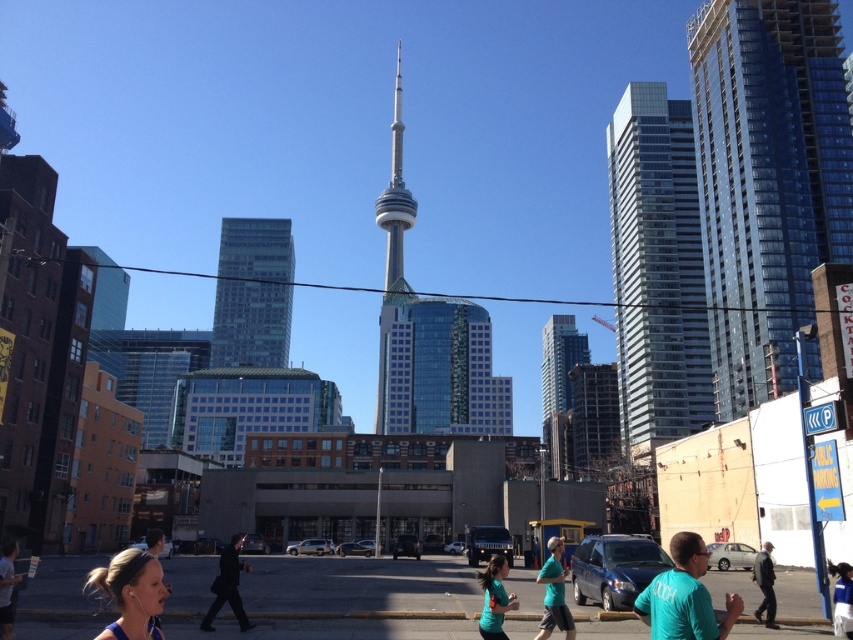
Question: In this image, where is teal t-shirt at lower right located relative to teal fabric shirt at lower center?

Choices:
 (A) below
 (B) above

Answer: (B)

Question: Is glassy steel tower at center positioned at the back of teal t-shirt at lower right?

Choices:
 (A) yes
 (B) no

Answer: (A)

Question: Which object is positioned farthest from the glassy reflective skyscraper at center?

Choices:
 (A) glassy silver skyscraper at right
 (B) blue fabric at lower left
 (C) glassy blue skyscraper at right

Answer: (B)

Question: Among these objects, which one is nearest to the camera?

Choices:
 (A) glassy reflective skyscraper at center
 (B) glassy steel tower at center
 (C) teal t-shirt at lower left
 (D) teal t-shirt at lower right

Answer: (D)

Question: Is glassy silver skyscraper at right above glassy reflective skyscraper at center?

Choices:
 (A) yes
 (B) no

Answer: (A)

Question: Which object is farther from the camera taking this photo?

Choices:
 (A) black matte suit at center
 (B) glassy blue skyscraper at right

Answer: (B)